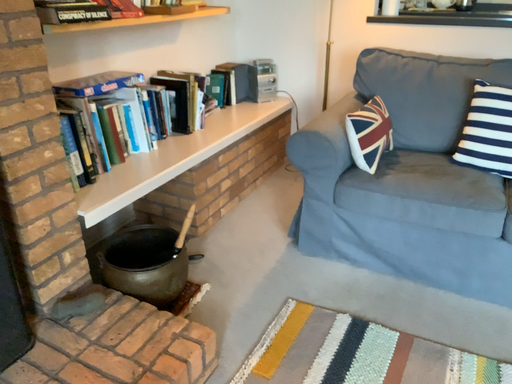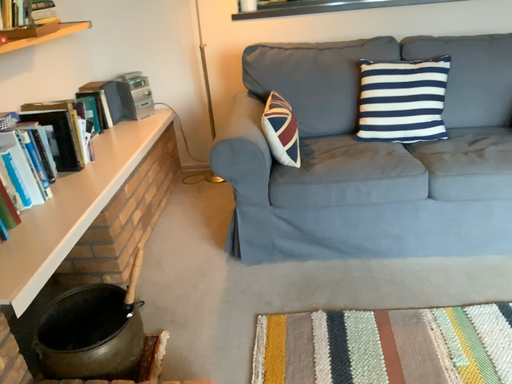
Question: How did the camera likely rotate when shooting the video?

Choices:
 (A) rotated left
 (B) rotated right

Answer: (B)